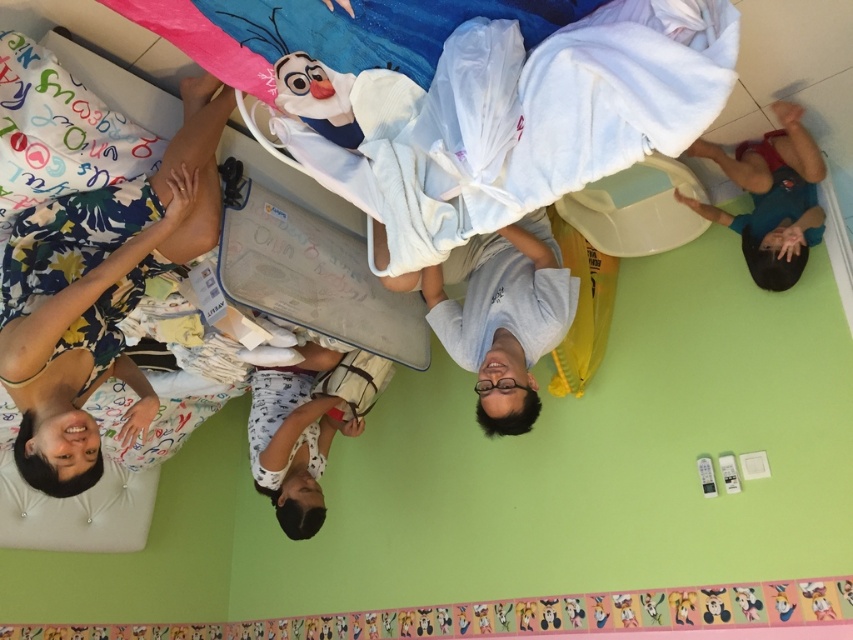
Question: Which point is closer to the camera?

Choices:
 (A) floral fabric dress at lower left
 (B) blue cotton shirt at lower right
 (C) white fabric bed at upper left
 (D) white cotton shirt at center

Answer: (A)

Question: Does white fabric bed at upper left come behind floral fabric dress at lower left?

Choices:
 (A) yes
 (B) no

Answer: (A)

Question: Does blue cotton shirt at lower right have a lesser width compared to white cotton shirt at center?

Choices:
 (A) yes
 (B) no

Answer: (A)

Question: Estimate the real-world distances between objects in this image. Which object is closer to the white fabric bed at upper left?

Choices:
 (A) white cotton shirt at center
 (B) blue cotton shirt at lower right
 (C) floral fabric dress at lower left

Answer: (C)

Question: Which object is the farthest from the white fabric bed at upper left?

Choices:
 (A) white cotton shirt at center
 (B) blue cotton shirt at lower right

Answer: (B)

Question: Does white fabric bed at upper left have a smaller size compared to floral fabric dress at lower left?

Choices:
 (A) no
 (B) yes

Answer: (B)